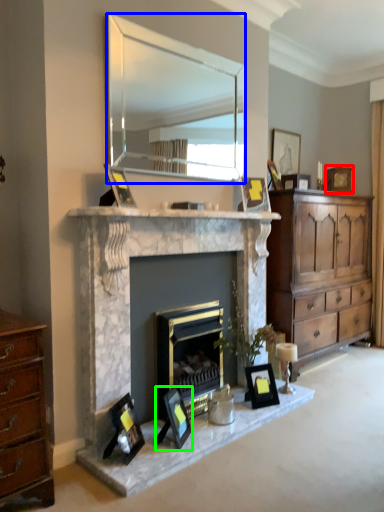
Question: Which object is positioned closest to picture frame (highlighted by a red box)? Select from mirror (highlighted by a blue box) and picture frame (highlighted by a green box).

Choices:
 (A) mirror
 (B) picture frame

Answer: (B)